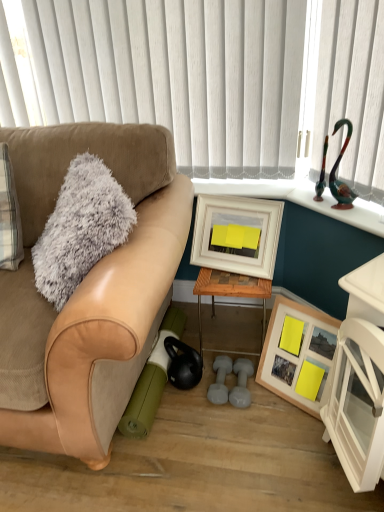
Question: Should I look upward or downward to see woodenmaterial/texturetable at center?

Choices:
 (A) down
 (B) up

Answer: (A)

Question: Is woodenmaterial/texturetable at center far from fuzzy gray throw pillow at left?

Choices:
 (A) no
 (B) yes

Answer: (A)

Question: Does woodenmaterial/texturetable at center have a larger size compared to fuzzy gray throw pillow at left?

Choices:
 (A) yes
 (B) no

Answer: (B)

Question: Is woodenmaterial/texturetable at center located outside fuzzy gray throw pillow at left?

Choices:
 (A) no
 (B) yes

Answer: (B)

Question: From a real-world perspective, is woodenmaterial/texturetable at center located beneath fuzzy gray throw pillow at left?

Choices:
 (A) yes
 (B) no

Answer: (A)

Question: From the image's perspective, would you say woodenmaterial/texturetable at center is positioned over fuzzy gray throw pillow at left?

Choices:
 (A) yes
 (B) no

Answer: (B)

Question: Can you confirm if woodenmaterial/texturetable at center is taller than fuzzy gray throw pillow at left?

Choices:
 (A) no
 (B) yes

Answer: (A)

Question: Can you confirm if fuzzy gray throw pillow at left is thinner than suede tan couch at left?

Choices:
 (A) yes
 (B) no

Answer: (A)

Question: Is fuzzy gray throw pillow at left smaller than suede tan couch at left?

Choices:
 (A) no
 (B) yes

Answer: (B)

Question: Does fuzzy gray throw pillow at left have a larger size compared to suede tan couch at left?

Choices:
 (A) no
 (B) yes

Answer: (A)

Question: Is fuzzy gray throw pillow at left in front of suede tan couch at left?

Choices:
 (A) yes
 (B) no

Answer: (B)

Question: From the image's perspective, is fuzzy gray throw pillow at left below suede tan couch at left?

Choices:
 (A) yes
 (B) no

Answer: (B)

Question: Does fuzzy gray throw pillow at left turn towards suede tan couch at left?

Choices:
 (A) no
 (B) yes

Answer: (B)

Question: Considering the relative sizes of woodenmaterial/texturetable at center and suede tan couch at left in the image provided, is woodenmaterial/texturetable at center taller than suede tan couch at left?

Choices:
 (A) yes
 (B) no

Answer: (B)